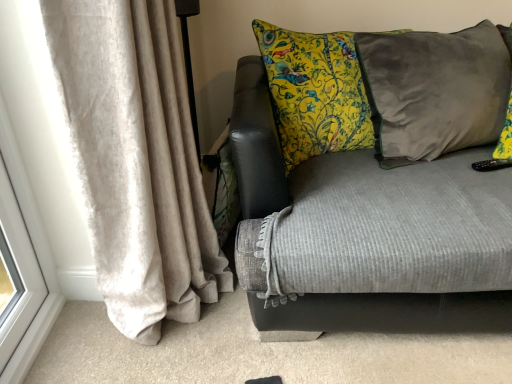
Question: Does velvet gray pillow at right have a greater height compared to velvet gray couch at center?

Choices:
 (A) no
 (B) yes

Answer: (A)

Question: Is there a large distance between velvet gray pillow at right and velvet gray couch at center?

Choices:
 (A) no
 (B) yes

Answer: (A)

Question: Does velvet gray pillow at right appear on the right side of velvet gray couch at center?

Choices:
 (A) no
 (B) yes

Answer: (B)

Question: Is velvet gray pillow at right smaller than velvet gray couch at center?

Choices:
 (A) yes
 (B) no

Answer: (A)

Question: Is the position of velvet gray pillow at right more distant than that of velvet gray couch at center?

Choices:
 (A) yes
 (B) no

Answer: (A)

Question: From a real-world perspective, is velvet gray pillow at right under velvet gray couch at center?

Choices:
 (A) no
 (B) yes

Answer: (A)

Question: From the image's perspective, would you say velvet gray pillow at right is positioned over beige velvet curtain at left?

Choices:
 (A) no
 (B) yes

Answer: (B)

Question: Is velvet gray pillow at right not near beige velvet curtain at left?

Choices:
 (A) no
 (B) yes

Answer: (A)

Question: Can you confirm if velvet gray pillow at right is bigger than beige velvet curtain at left?

Choices:
 (A) yes
 (B) no

Answer: (A)

Question: Is velvet gray pillow at right shorter than beige velvet curtain at left?

Choices:
 (A) yes
 (B) no

Answer: (A)

Question: Does velvet gray pillow at right come behind beige velvet curtain at left?

Choices:
 (A) yes
 (B) no

Answer: (A)

Question: Does velvet gray pillow at right appear on the right side of beige velvet curtain at left?

Choices:
 (A) yes
 (B) no

Answer: (A)

Question: Is velvet gray couch at center positioned far away from velvet gray pillow at right?

Choices:
 (A) no
 (B) yes

Answer: (A)